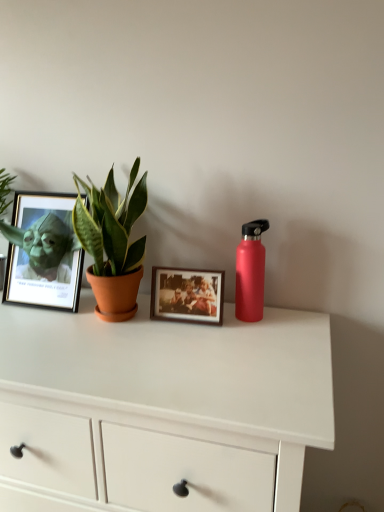
Question: In terms of height, does matte black frame at left, which is the 1th picture frame from left to right, look taller or shorter compared to white matte chest of drawers at center?

Choices:
 (A) short
 (B) tall

Answer: (A)

Question: Relative to white matte chest of drawers at center, is matte black frame at left, which is the 1th picture frame from left to right, in front or behind?

Choices:
 (A) front
 (B) behind

Answer: (B)

Question: Considering the real-world distances, which object is farthest from the green matte plant at left?

Choices:
 (A) wooden photo frame at center, acting as the 1th picture frame starting from the right
 (B) matte red water bottle at right
 (C) white matte chest of drawers at center
 (D) matte black frame at left, the second picture frame in the right-to-left sequence

Answer: (B)

Question: Which is farther from the green matte plant at left?

Choices:
 (A) matte red water bottle at right
 (B) matte black frame at left, which is the 1th picture frame from left to right
 (C) wooden photo frame at center, acting as the 1th picture frame starting from the right
 (D) white matte chest of drawers at center

Answer: (A)